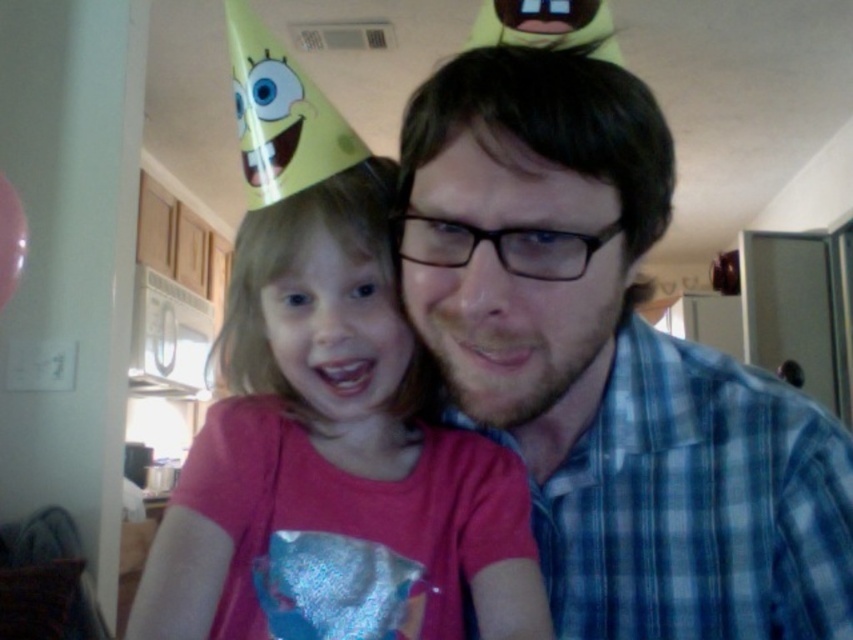
You are a tailor who needs to determine which shirt, the blue plaid shirt at center or the pink matte shirt at center, requires more fabric for alterations. Based on their sizes, which one would need more fabric?

The blue plaid shirt at center has a larger size compared to the pink matte shirt at center, so it would require more fabric for alterations.

You are a photographer trying to frame a photo of the blue plaid shirt at center and the pink matte shirt at center. Which shirt should you focus on to ensure it appears larger in the photo?

The blue plaid shirt at center is taller than the pink matte shirt at center, so focusing on the blue plaid shirt at center would make it appear larger in the photo.